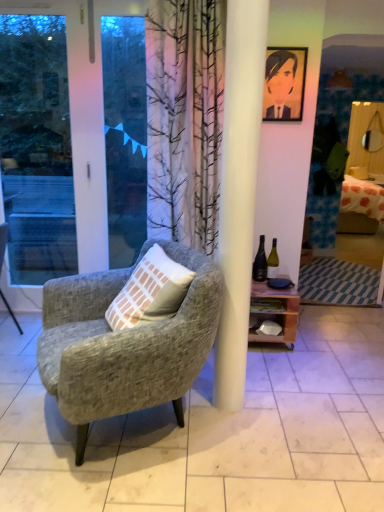
This screenshot has height=512, width=384. Identify the location of vacant area that lies to the right of wooden at right. (317, 340).